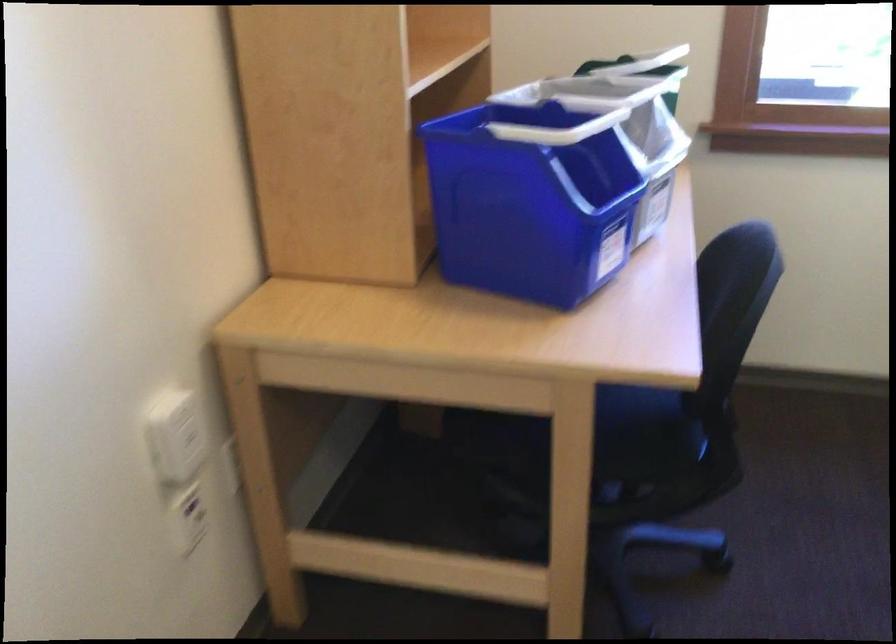
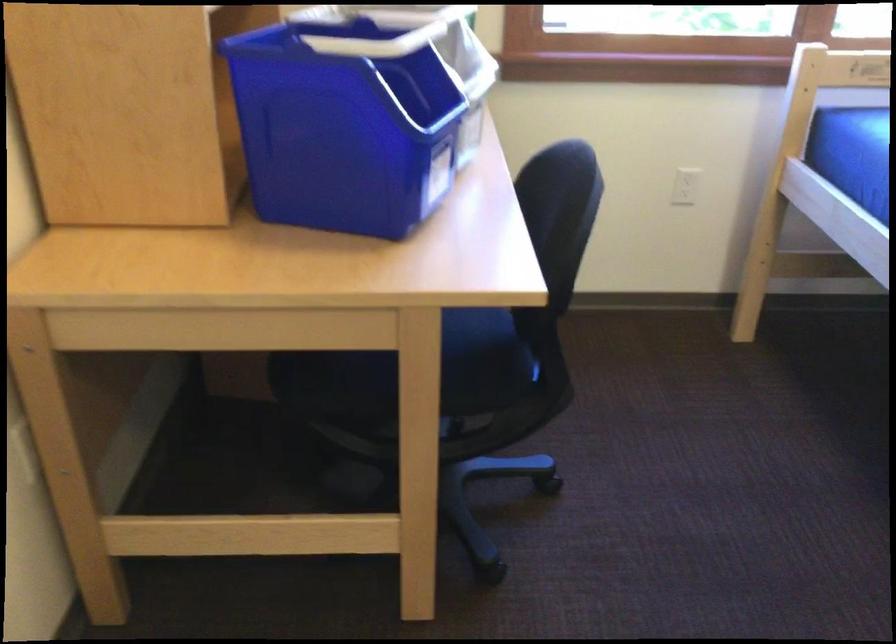
Locate, in the second image, the point that corresponds to point (716, 93) in the first image.

(506, 26)